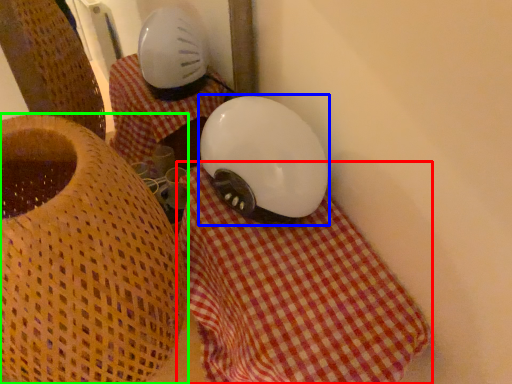
Question: Which object is positioned farthest from blanket (highlighted by a red box)? Select from helmet (highlighted by a blue box) and furniture (highlighted by a green box).

Choices:
 (A) helmet
 (B) furniture

Answer: (B)